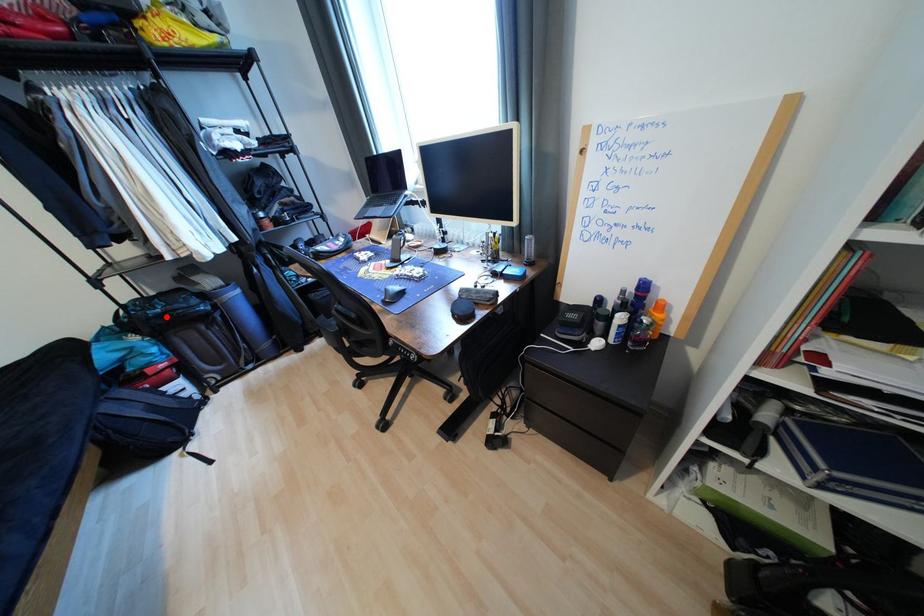
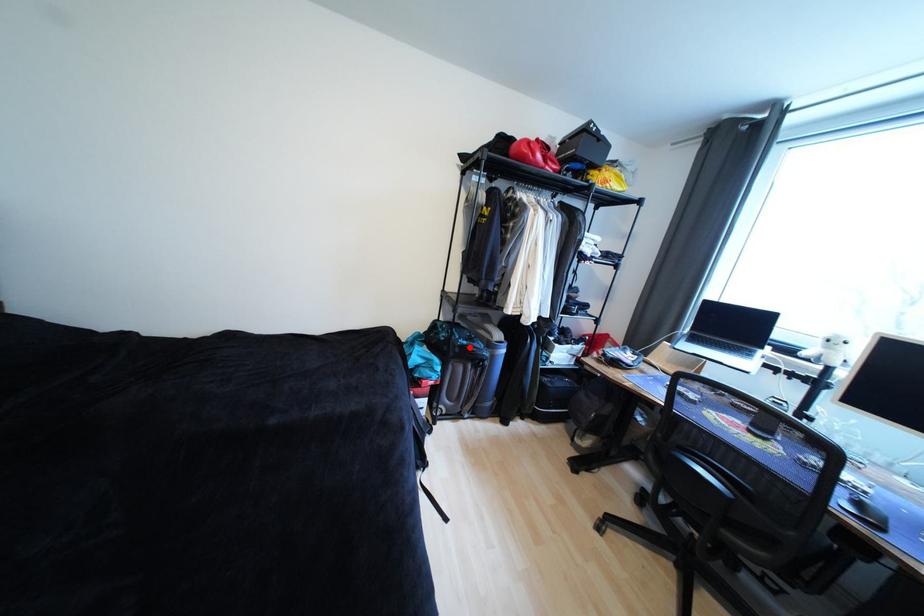
I am providing you with two images of the same scene from different viewpoints. A red point is marked on the first image and another point is marked on the second image. Are the points marked in image1 and image2 representing the same 3D position?

Yes